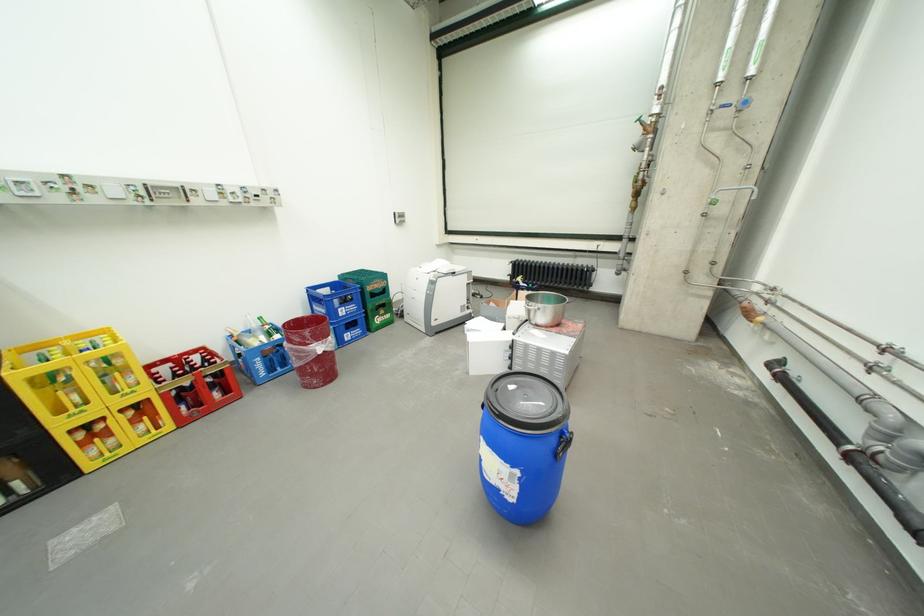
Where is `red plastic bucket`? This screenshot has width=924, height=616. red plastic bucket is located at coordinates (310, 350).